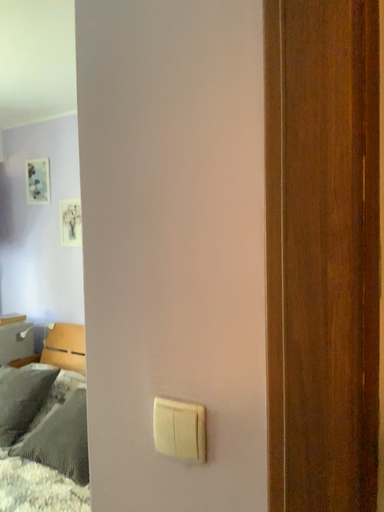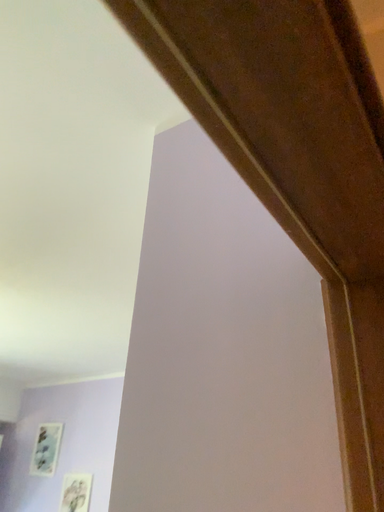
Question: Which way did the camera rotate in the video?

Choices:
 (A) rotated downward
 (B) rotated upward

Answer: (B)